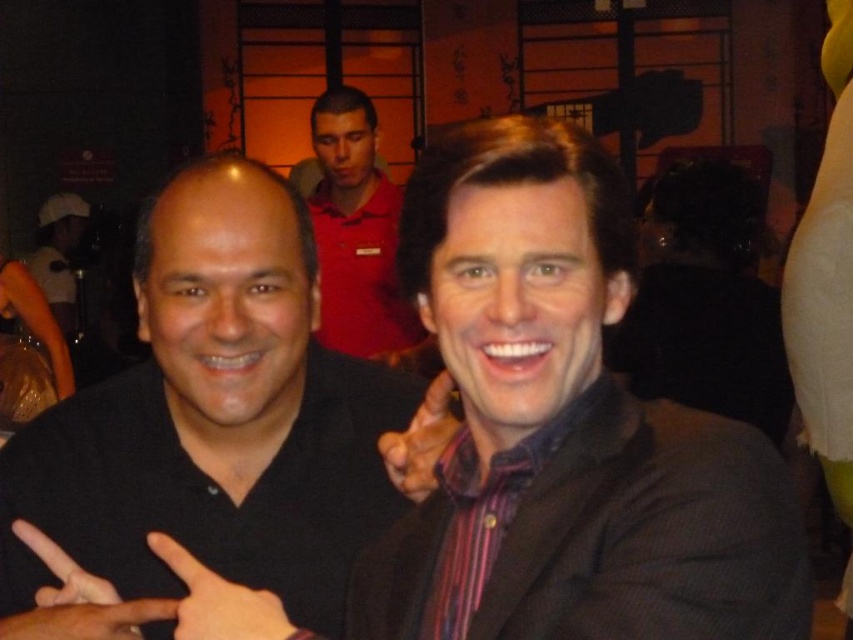
Question: Based on their relative distances, which object is nearer to the black matte hand at lower left?

Choices:
 (A) matte red polo shirt at center
 (B) striped shirt at center

Answer: (A)

Question: Is black shirt at left smaller than smooth skin finger at center?

Choices:
 (A) no
 (B) yes

Answer: (A)

Question: Which point is closer to the camera taking this photo?

Choices:
 (A) (483, 355)
 (B) (350, 344)

Answer: (A)

Question: Does striped shirt at center come in front of matte black hand at center?

Choices:
 (A) yes
 (B) no

Answer: (B)

Question: Which object is positioned farthest from the matte black hand at center?

Choices:
 (A) matte red polo shirt at center
 (B) black shirt at left
 (C) striped shirt at center

Answer: (A)

Question: Is black matte shirt at left wider than matte black hand at center?

Choices:
 (A) no
 (B) yes

Answer: (B)